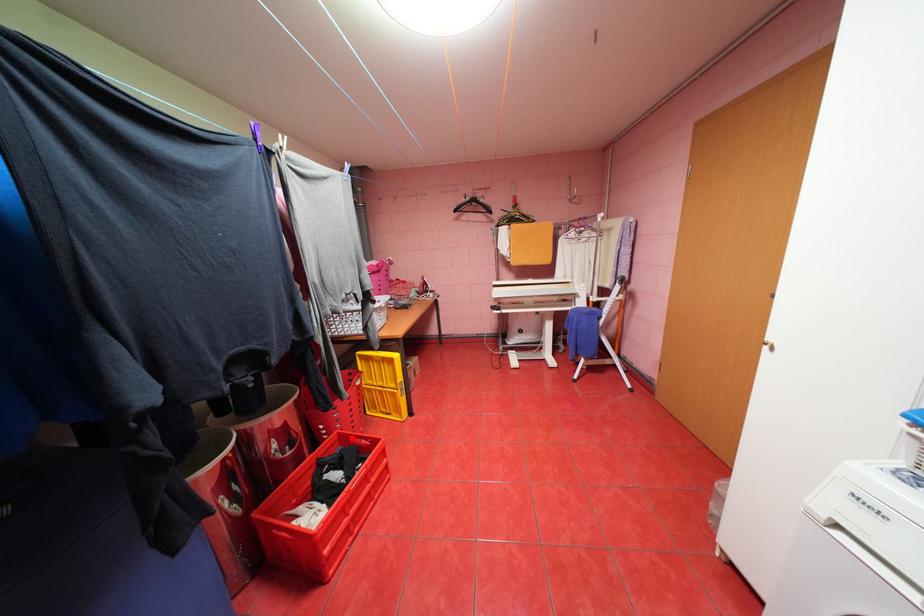
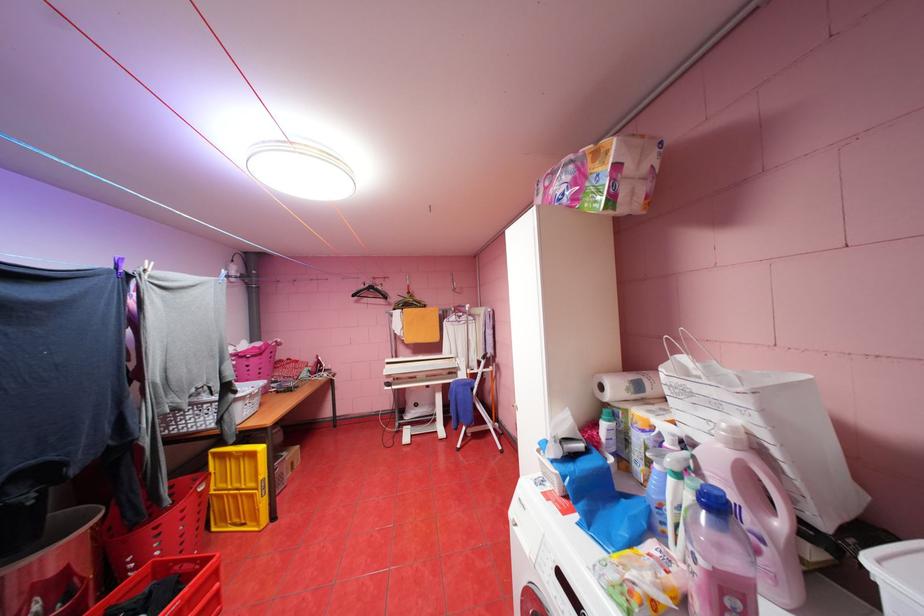
The point at the highlighted location is marked in the first image. Where is the corresponding point in the second image?

(169, 569)